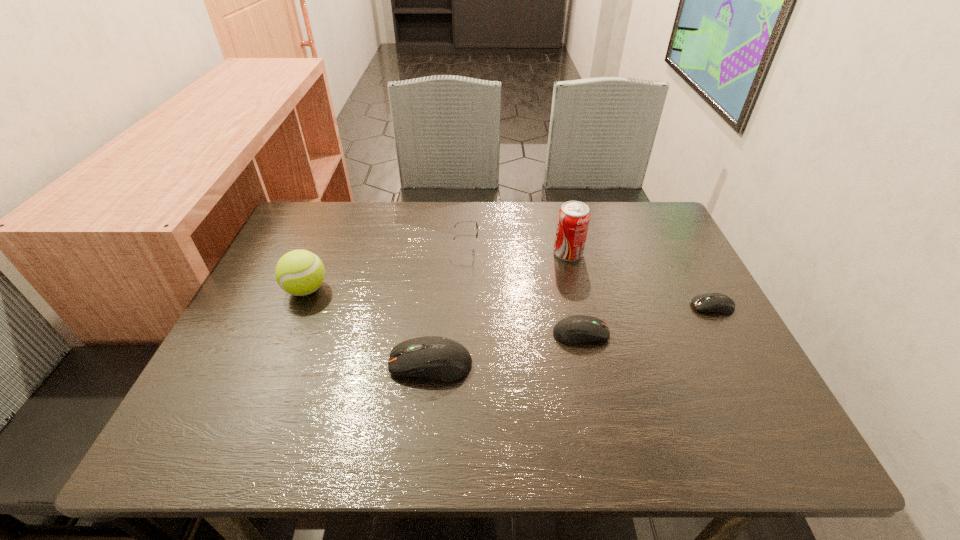
Identify the location of the third shortest object. (440, 358).

Locate an element on the screen. The image size is (960, 540). the nearest computer equipment is located at coordinates (440, 358).

Locate an element on the screen. The width and height of the screenshot is (960, 540). the fifth farthest object is located at coordinates (575, 329).

In order to click on the second nearest computer equipment in this screenshot , I will do `click(575, 329)`.

You are a GUI agent. You are given a task and a screenshot of the screen. Output one action in this format:
    pyautogui.click(x=<x>, y=<y>)
    Task: Click on the shortest computer equipment
    
    Given the screenshot: What is the action you would take?
    click(719, 303)

Locate an element on the screen. The width and height of the screenshot is (960, 540). the shortest object is located at coordinates (719, 303).

The image size is (960, 540). Identify the location of sunglasses. (466, 221).

Locate an element on the screen. The image size is (960, 540). the tallest object is located at coordinates (573, 220).

Image resolution: width=960 pixels, height=540 pixels. What are the coordinates of `the fifth shortest object` in the screenshot? It's located at (299, 272).

Locate an element on the screen. This screenshot has height=540, width=960. the leftmost object is located at coordinates (299, 272).